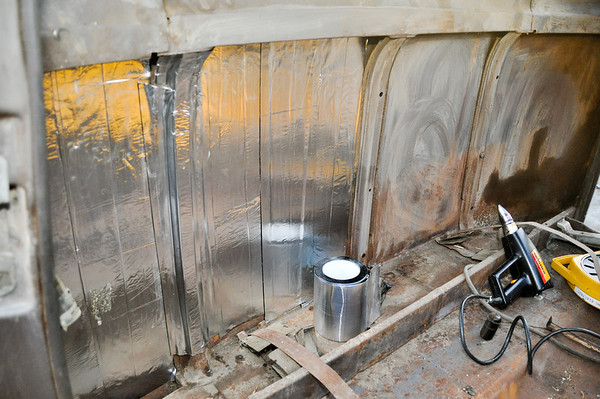
Find the location of a particular element. This screenshot has height=399, width=600. reflective wall sheets is located at coordinates (86, 169), (228, 171), (452, 138), (553, 122).